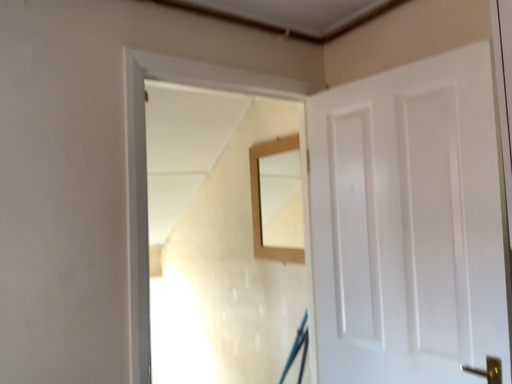
Question: Is point (259, 211) positioned closer to the camera than point (434, 172)?

Choices:
 (A) farther
 (B) closer

Answer: (A)

Question: In the image, is wooden mirror at center on the left side or the right side of white glossy door at right?

Choices:
 (A) left
 (B) right

Answer: (A)

Question: Based on their relative distances, which object is farther from the white glossy door at right?

Choices:
 (A) wooden frame at center
 (B) wooden mirror at center

Answer: (B)

Question: Which object is positioned closest to the wooden frame at center?

Choices:
 (A) white glossy door at right
 (B) wooden mirror at center

Answer: (A)